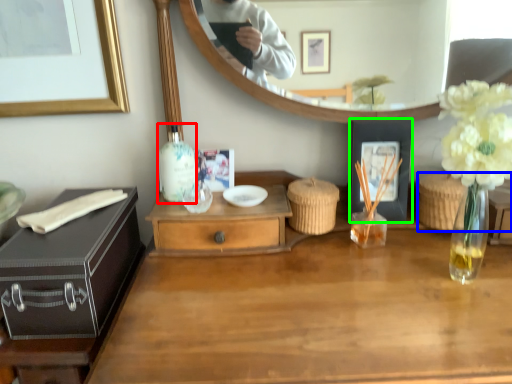
Question: Which is farther away from bottle (highlighted by a red box)? picnic basket (highlighted by a blue box) or picture frame (highlighted by a green box)?

Choices:
 (A) picnic basket
 (B) picture frame

Answer: (A)